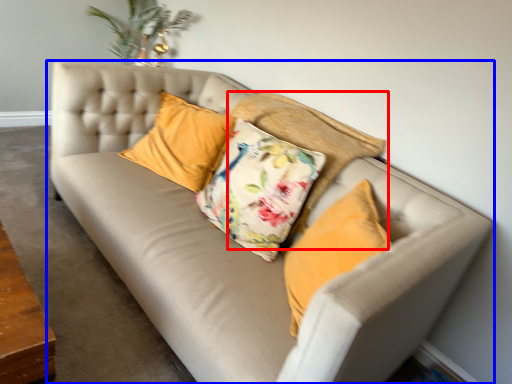
Question: Which object is closer to the camera taking this photo, pillow (highlighted by a red box) or studio couch (highlighted by a blue box)?

Choices:
 (A) pillow
 (B) studio couch

Answer: (B)